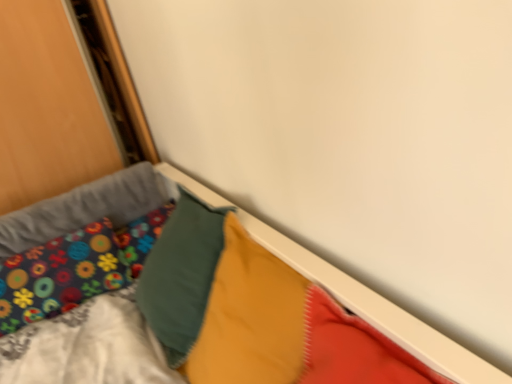
What do you see at coordinates (75, 268) in the screenshot? Image resolution: width=512 pixels, height=384 pixels. I see `floral fabric pillow at left` at bounding box center [75, 268].

Identify the location of floral fabric pillow at left. This screenshot has height=384, width=512. (75, 268).

Locate an element on the screen. The height and width of the screenshot is (384, 512). floral fabric pillow at left is located at coordinates (75, 268).